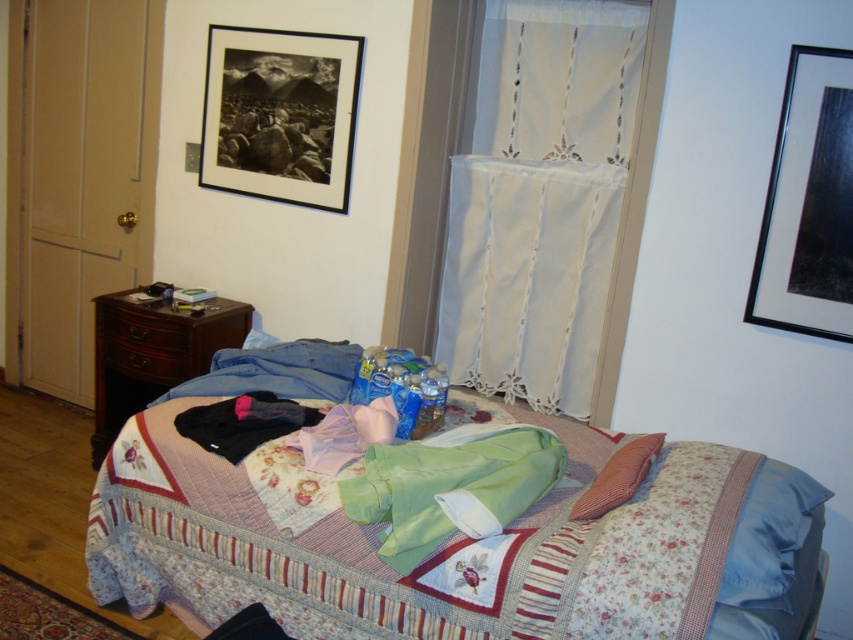
Question: Which of the following is the closest to the observer?

Choices:
 (A) (242, 374)
 (B) (183, 342)

Answer: (A)

Question: Does white lace curtain at upper center appear under black matte picture frame at upper right?

Choices:
 (A) no
 (B) yes

Answer: (A)

Question: Based on their relative distances, which object is nearer to the floral quilted bed at center?

Choices:
 (A) mahogany wood drawer at left
 (B) green satin shirt at center
 (C) denim at left

Answer: (B)

Question: Does black matte picture frame at upper left have a larger size compared to brown wood dresser at left?

Choices:
 (A) yes
 (B) no

Answer: (B)

Question: Which point is farther from the camera taking this photo?

Choices:
 (A) [448, 483]
 (B) [579, 243]
 (C) [112, 320]
 (D) [634, 490]

Answer: (C)

Question: Is green satin shirt at center below black fabric at center?

Choices:
 (A) no
 (B) yes

Answer: (B)